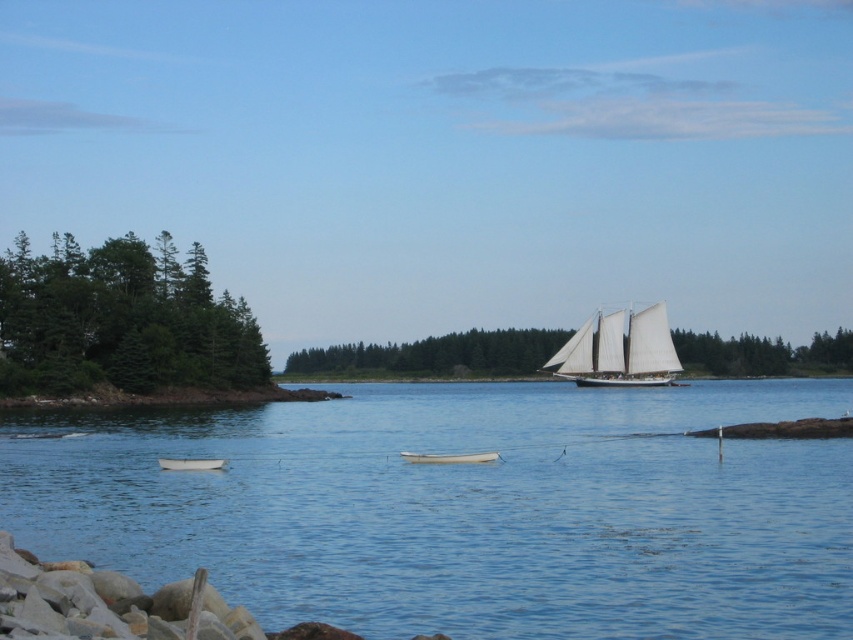
This screenshot has height=640, width=853. What do you see at coordinates (465, 508) in the screenshot?
I see `clear blue water at center` at bounding box center [465, 508].

Find the location of `clear blue water at center`. clear blue water at center is located at coordinates (465, 508).

Is white matte boat at center thinner than white matte rowboat at lower left?

Incorrect, white matte boat at center's width is not less than white matte rowboat at lower left's.

Does white matte boat at center have a greater height compared to white matte rowboat at lower left?

Indeed, white matte boat at center has a greater height compared to white matte rowboat at lower left.

Find the location of a particular element. The height and width of the screenshot is (640, 853). white matte boat at center is located at coordinates (450, 458).

Where is `white matte boat at center`? white matte boat at center is located at coordinates (450, 458).

Measure the distance between clear blue water at center and camera.

They are 16.26 meters apart.

Is point (321, 413) behind point (474, 456)?

That is True.

Find the location of a particular element. clear blue water at center is located at coordinates (465, 508).